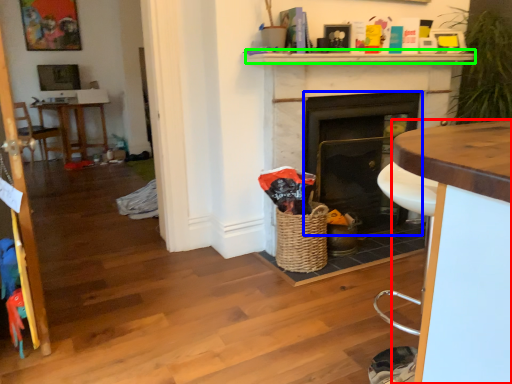
Question: Considering the real-world distances, which object is farthest from desk (highlighted by a red box)? fireplace (highlighted by a blue box) or mantle (highlighted by a green box)?

Choices:
 (A) fireplace
 (B) mantle

Answer: (A)